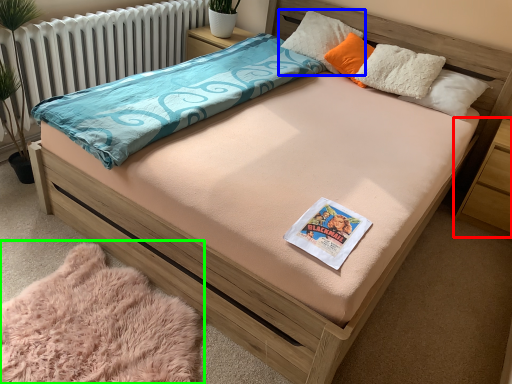
Question: Based on their relative distances, which object is nearer to nightstand (highlighted by a red box)? Choose from pillow (highlighted by a blue box) and blanket (highlighted by a green box).

Choices:
 (A) pillow
 (B) blanket

Answer: (A)